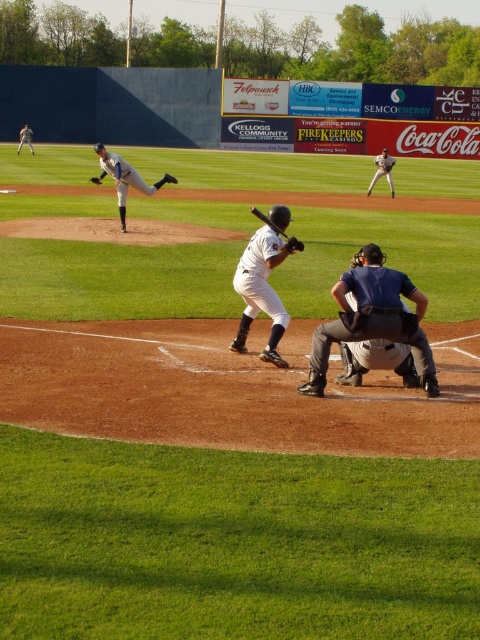
Consider the image. You are a baseball player trying to determine if you can fit between the gray fabric umpire at center and the brown leather glove at upper center. Can you squeeze through the space between them?

The gray fabric umpire at center is thinner than the brown leather glove at upper center, so there might be enough space to squeeze through, but it would be tight.

You are a spectator at the baseball game. You notice the white uniformed player at center and the brown leather glove at upper center. Which object is closer to the left side of the image?

The white uniformed player at center is closer to the left side of the image because it is positioned to the left of the brown leather glove at upper center.

You are a spectator sitting in the stands and want to take a photo of the white uniformed pitcher at upper left. If your camera has a maximum zoom range of 10 meters, can you capture a clear image of the pitcher?

The white uniformed pitcher at upper left is 14.64 meters from the viewer, which is beyond the camera maximum zoom range of 10 meters. Therefore, the camera cannot capture a clear image of the pitcher.